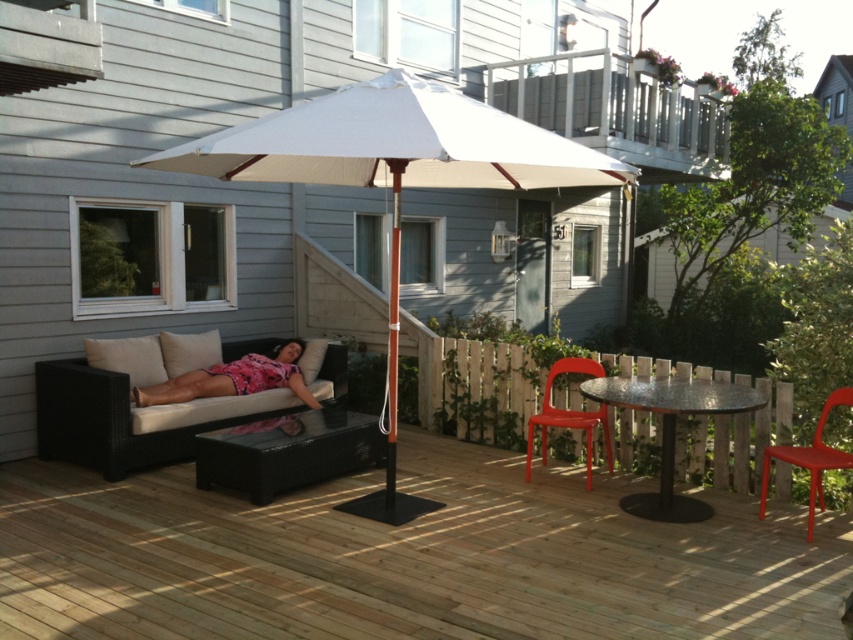
You are planning to place a rectangular plant pot that is 1.2 meters wide on the patio. The pot must be placed on either the black glass table at center or the red plastic chair at lower right. Which surface can accommodate the plant pot based on their widths?

The black glass table at center has a width larger than the red plastic chair at lower right, so the plant pot that is 1.2 meters wide can be placed on the black glass table at center.

You are standing at the point marked by coordinates (405, 557) on the wooden deck at center. Which direction should you walk to reach the black wicker sofa with beige cushions?

The wooden deck at center is located at coordinates (405, 557). Since the black wicker sofa with beige cushions is to the left of the wooden deck at center, you should walk to the left to reach it.